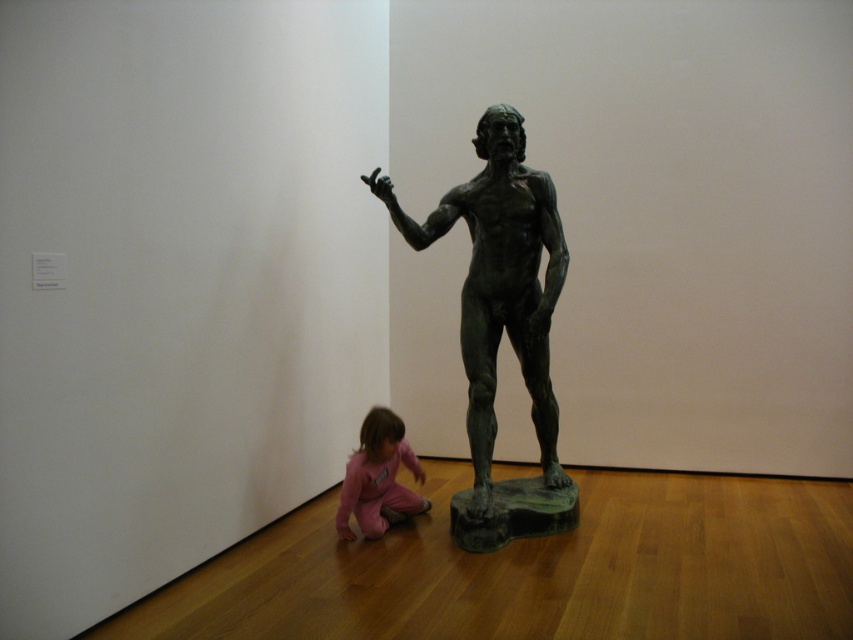
You are a visitor in the museum and want to take a photo of the green patina bronze statue at center without the pink fabric child at lower center appearing in the shot. Which direction should you move to achieve this?

The green patina bronze statue at center is in front of pink fabric child at lower center, so you should move backward to create distance between the statue and the child, ensuring the child is out of the frame.

You are a photographer trying to capture a photo of the green patina bronze statue at center and the pink fabric child at lower center. Since you want to ensure both subjects are in focus, you need to know which one is taller. Can you determine which object is taller?

The green patina bronze statue at center is taller than the pink fabric child at lower center according to the description.